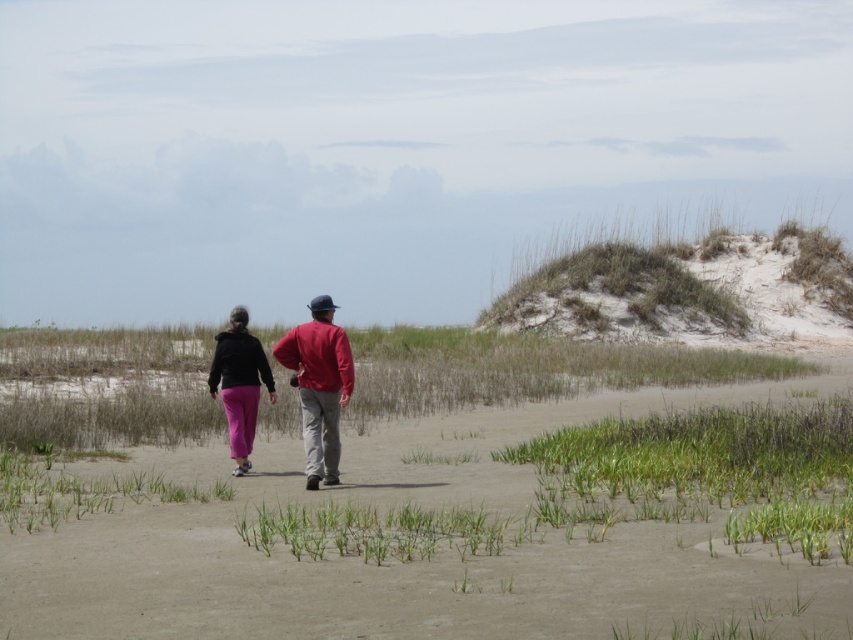
You are standing at the camera position and see two points in the scene. Which point, point [289,332] or point [225,355], is closer to you?

Point [289,332] is closer to the camera than point [225,355].

You are a photographer trying to capture both the matte red jacket at center and the matte black jacket at center in a single frame. Based on their heights, which jacket will appear closer to the top of the photo?

The matte black jacket at center will appear closer to the top of the photo because it is taller than the matte red jacket at center.